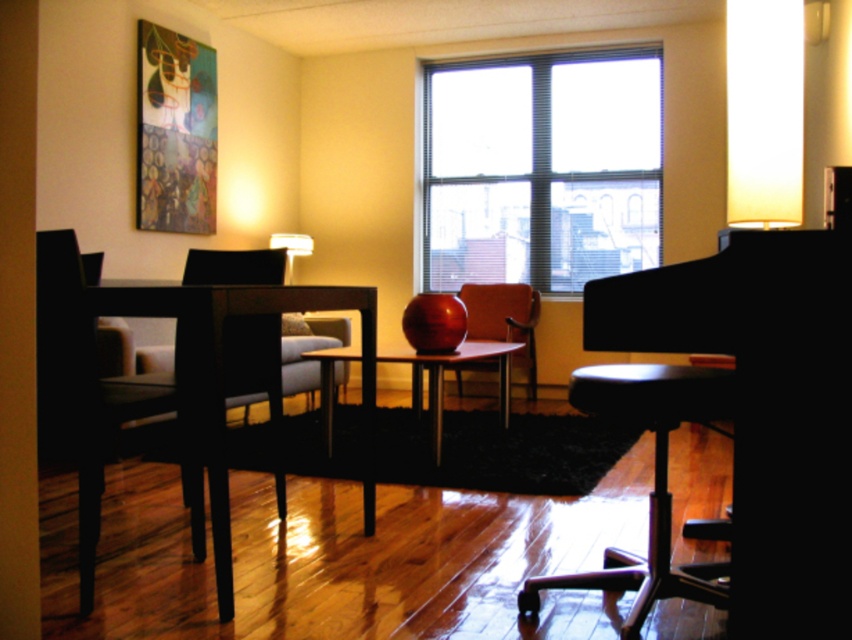
Is transparent glass window at upper center to the right of matte orange chair at center from the viewer's perspective?

Indeed, transparent glass window at upper center is positioned on the right side of matte orange chair at center.

Looking at this image, who is lower down, transparent glass window at upper center or matte orange chair at center?

Positioned lower is matte orange chair at center.

Based on the photo, who is more distant from viewer, (617, 122) or (530, 365)?

The point (617, 122) is behind.

Where is `transparent glass window at upper center`? transparent glass window at upper center is located at coordinates (540, 168).

Is black plastic stool at lower right positioned in front of matte wood table at center?

Yes, it is.

Can you confirm if black plastic stool at lower right is positioned below matte wood table at center?

Yes, black plastic stool at lower right is below matte wood table at center.

This screenshot has width=852, height=640. Identify the location of black plastic stool at lower right. (653, 481).

At what (x,y) coordinates should I click in order to perform the action: click on black glossy piano at center. Please return your answer as a coordinate pair (x, y). Image resolution: width=852 pixels, height=640 pixels. Looking at the image, I should click on (764, 410).

Between black glossy piano at center and black plastic stool at lower right, which one is positioned lower?

black plastic stool at lower right is below.

Is point (804, 493) closer to camera compared to point (734, 374)?

That is True.

Find the location of `black glossy piano at center`. black glossy piano at center is located at coordinates (764, 410).